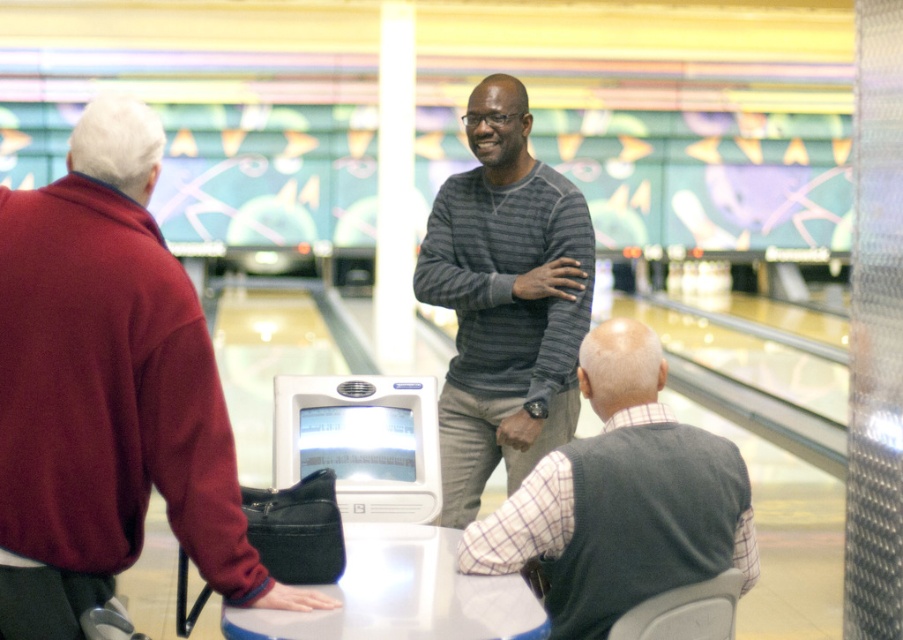
In the bowling alley scene, there are two people wearing maroon sweater at center and gray sweater at center. Which one is positioned higher in the image?

The maroon sweater at center is located above the gray sweater at center in the image.

You are a photographer taking a group photo of the maroon sweater at center and striped sweater at center. Which sweater should you focus on first if you want to capture the taller one?

The striped sweater at center is taller than the maroon sweater at center, so you should focus on the striped sweater at center first.